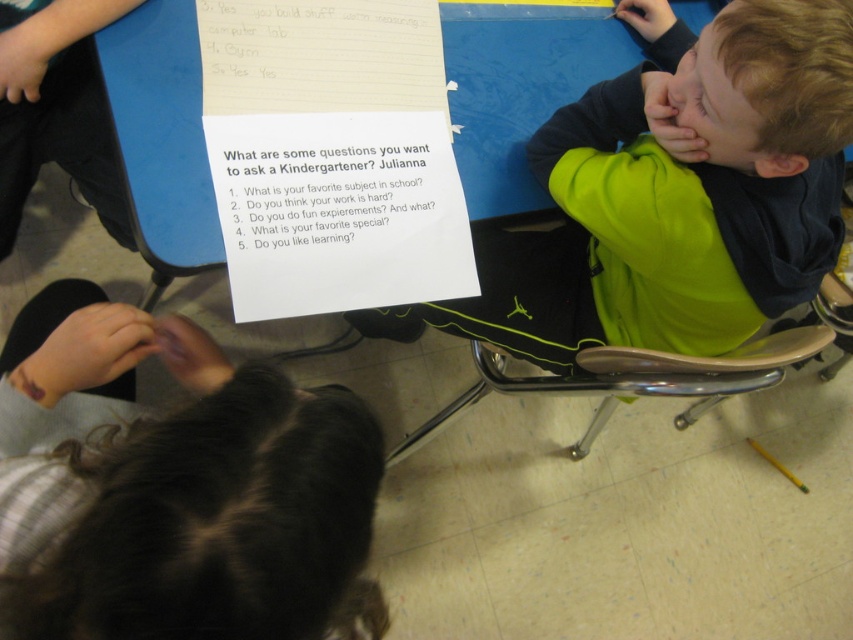
Between neon green hoodie at right and white paper at center, which one has less height?

white paper at center is shorter.

Looking at this image, which is more to the right, neon green hoodie at right or white paper at center?

Positioned to the right is neon green hoodie at right.

Does point (421, 320) come in front of point (312, 179)?

No, it is behind (312, 179).

In order to click on neon green hoodie at right in this screenshot , I will do `click(672, 196)`.

Between dark brown hair at lower left and white paper at upper center, which one appears on the right side from the viewer's perspective?

Positioned to the right is white paper at upper center.

Measure the distance between dark brown hair at lower left and white paper at upper center.

27.45 centimeters

Which is in front, point (299, 499) or point (265, 92)?

Positioned in front is point (299, 499).

In order to click on dark brown hair at lower left in this screenshot , I will do `click(175, 486)`.

Who is shorter, neon green hoodie at right or white paper at upper center?

Answer: With less height is white paper at upper center.

This screenshot has height=640, width=853. What do you see at coordinates (672, 196) in the screenshot?
I see `neon green hoodie at right` at bounding box center [672, 196].

At what (x,y) coordinates should I click in order to perform the action: click on neon green hoodie at right. Please return your answer as a coordinate pair (x, y). This screenshot has height=640, width=853. Looking at the image, I should click on (672, 196).